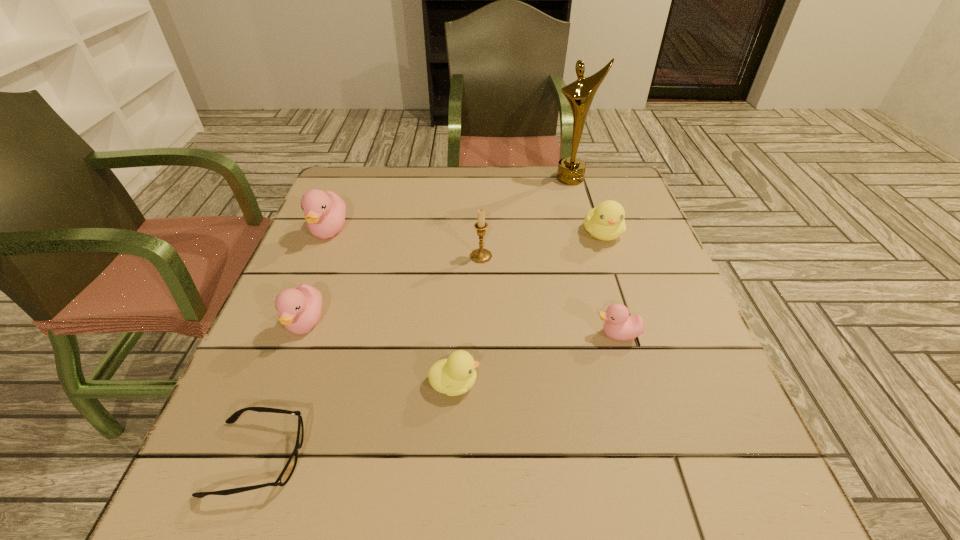
Where is `vacant space located on the front-facing side of the rightmost pink duckling`? The width and height of the screenshot is (960, 540). vacant space located on the front-facing side of the rightmost pink duckling is located at coordinates (509, 334).

I want to click on vacant space located on the front-facing side of the rightmost pink duckling, so click(x=560, y=334).

In order to click on vacant space situated 0.190m on the front-facing side of the spectacles in this screenshot , I will do `click(424, 458)`.

Locate an element on the screen. object positioned at the far edge is located at coordinates (571, 170).

The width and height of the screenshot is (960, 540). I want to click on object that is at the near edge, so click(285, 475).

Identify the location of spectacles at the left edge. The width and height of the screenshot is (960, 540). (285, 475).

Find the location of a particular element. The image size is (960, 540). award positioned at the right edge is located at coordinates (571, 170).

At what (x,y) coordinates should I click in order to perform the action: click on object that is at the near left corner. Please return your answer as a coordinate pair (x, y). This screenshot has height=540, width=960. Looking at the image, I should click on (285, 475).

Locate an element on the screen. The image size is (960, 540). object present at the far right corner is located at coordinates (571, 170).

Image resolution: width=960 pixels, height=540 pixels. What are the coordinates of `vacant area at the far edge of the desktop` in the screenshot? It's located at (556, 199).